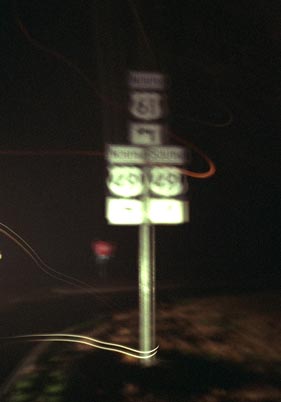
At what (x,y) coordinates should I click in order to perform the action: click on light. Please return your answer as a coordinate pair (x, y). This screenshot has height=402, width=281. Looking at the image, I should click on pyautogui.click(x=159, y=210).